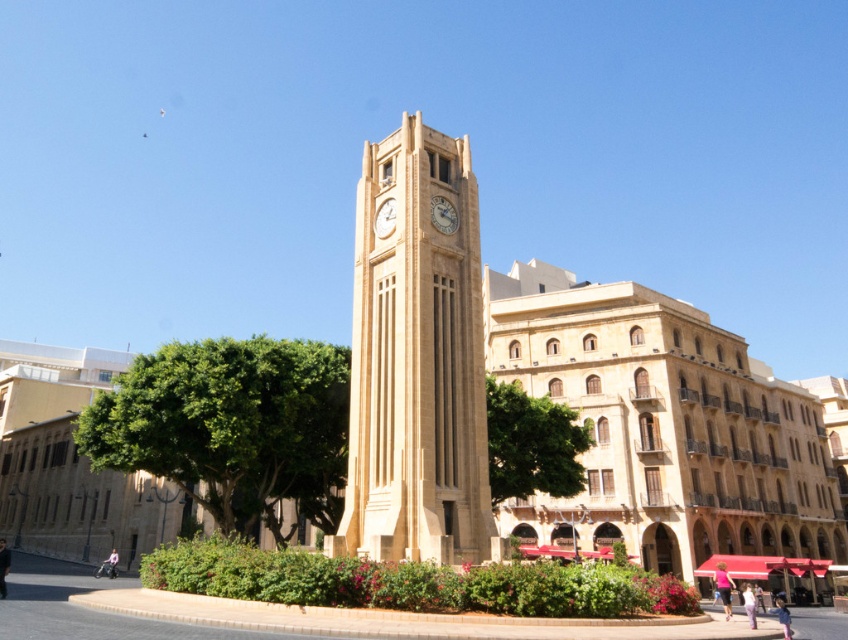
Question: Based on their relative distances, which object is nearer to the green leafy tree at lower left?

Choices:
 (A) golden stone clock at center
 (B) green leafy tree at center
 (C) golden textured clock at center
 (D) beige stone clock tower at center

Answer: (D)

Question: Is beige stone clock tower at center positioned before golden stone clock at center?

Choices:
 (A) no
 (B) yes

Answer: (B)

Question: Estimate the real-world distances between objects in this image. Which object is closer to the golden stone clock at center?

Choices:
 (A) green leafy tree at center
 (B) green leafy tree at lower left

Answer: (A)

Question: Does green leafy tree at center appear over golden stone clock at center?

Choices:
 (A) no
 (B) yes

Answer: (A)

Question: Observing the image, what is the correct spatial positioning of green leafy tree at lower left in reference to green leafy tree at center?

Choices:
 (A) above
 (B) below

Answer: (B)

Question: Among these objects, which one is farthest from the camera?

Choices:
 (A) green leafy tree at lower left
 (B) beige stone clock tower at center
 (C) golden textured clock at center

Answer: (C)